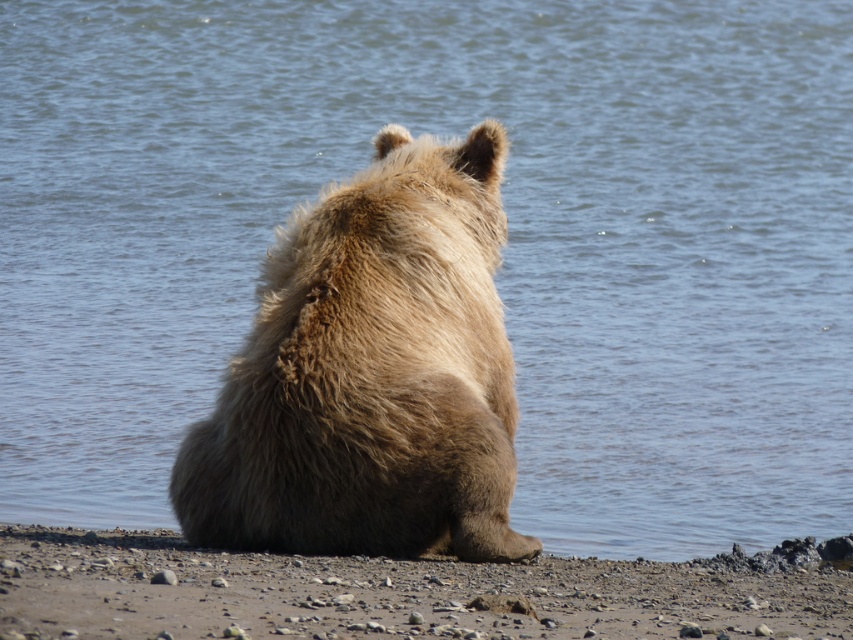
In the scene shown: Does fuzzy brown bear at center appear under brown gravelly sand at lower center?

No, fuzzy brown bear at center is not below brown gravelly sand at lower center.

Which is in front, point (450, 522) or point (189, 628)?

Point (189, 628)

Find the location of `fuzzy brown bear at center`. fuzzy brown bear at center is located at coordinates (370, 372).